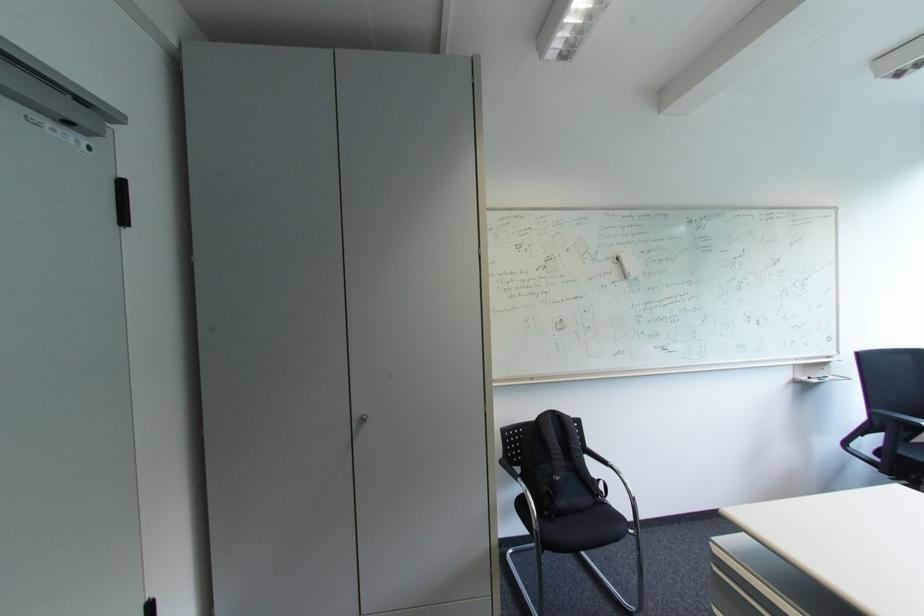
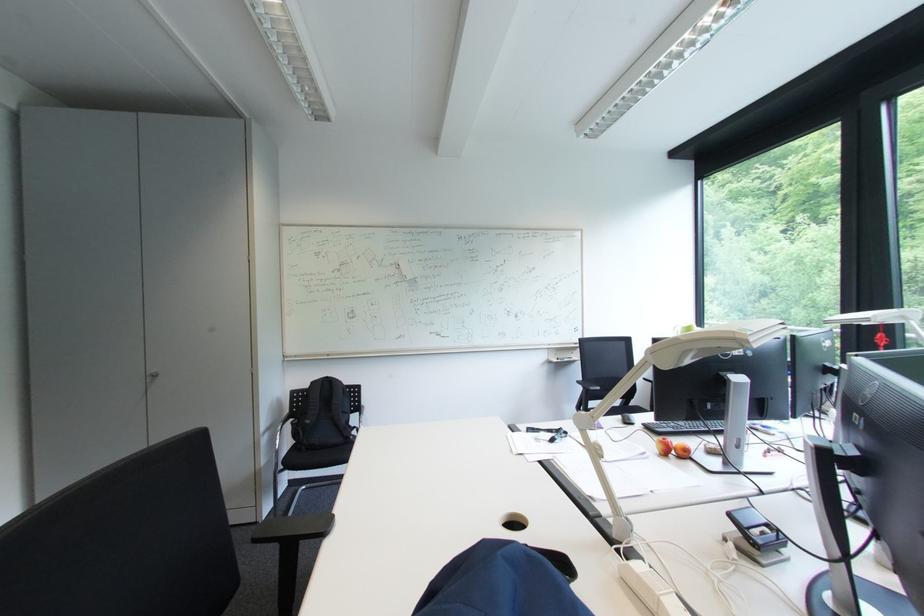
The images are taken continuously from a first-person perspective. In which direction are you moving?

The cameraman walked toward right, backward.